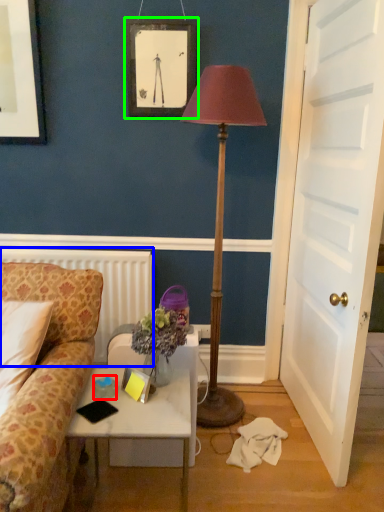
Question: Which is nearer to the coffee cup (highlighted by a red box)? radiator (highlighted by a blue box) or picture frame (highlighted by a green box).

Choices:
 (A) radiator
 (B) picture frame

Answer: (A)